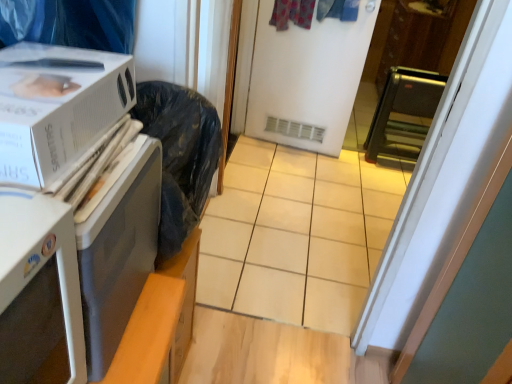
Question: Can you confirm if white matte screen door at center is taller than white plastic microwave at left, the first appliance ordered from the bottom?

Choices:
 (A) yes
 (B) no

Answer: (A)

Question: From the image's perspective, is white matte screen door at center under white plastic microwave at left, the first appliance ordered from the bottom?

Choices:
 (A) yes
 (B) no

Answer: (B)

Question: Is white matte screen door at center closer to camera compared to white plastic microwave at left, which ranks as the first appliance in front-to-back order?

Choices:
 (A) yes
 (B) no

Answer: (B)

Question: Could you tell me if white matte screen door at center is turned towards white plastic microwave at left, the first appliance ordered from the bottom?

Choices:
 (A) no
 (B) yes

Answer: (B)

Question: Is white matte screen door at center far away from white plastic microwave at left, the 2th appliance when ordered from top to bottom?

Choices:
 (A) no
 (B) yes

Answer: (B)

Question: Considering the relative sizes of white matte screen door at center and white plastic microwave at left, the first appliance ordered from the bottom, in the image provided, is white matte screen door at center bigger than white plastic microwave at left, the first appliance ordered from the bottom,?

Choices:
 (A) no
 (B) yes

Answer: (B)

Question: From a real-world perspective, does white cardboard box at left stand above white plastic microwave at left, the 2th appliance positioned from the back?

Choices:
 (A) no
 (B) yes

Answer: (B)

Question: Does white cardboard box at left have a smaller size compared to white plastic microwave at left, the second appliance viewed from the right?

Choices:
 (A) yes
 (B) no

Answer: (A)

Question: Considering the relative sizes of white cardboard box at left and white plastic microwave at left, which ranks as the first appliance in front-to-back order, in the image provided, is white cardboard box at left taller than white plastic microwave at left, which ranks as the first appliance in front-to-back order,?

Choices:
 (A) no
 (B) yes

Answer: (A)

Question: From the image's perspective, is white cardboard box at left on white plastic microwave at left, which ranks as the first appliance in front-to-back order?

Choices:
 (A) yes
 (B) no

Answer: (A)

Question: Is white cardboard box at left further to camera compared to white plastic microwave at left, the 2th appliance positioned from the back?

Choices:
 (A) no
 (B) yes

Answer: (A)

Question: Is white plastic microwave at left, the second appliance viewed from the right, at the back of white cardboard box at left?

Choices:
 (A) no
 (B) yes

Answer: (A)

Question: From the image's perspective, is black metallic toaster oven at right, the 1th appliance from the top, on white plastic microwave at left, which ranks as the first appliance in front-to-back order?

Choices:
 (A) yes
 (B) no

Answer: (A)